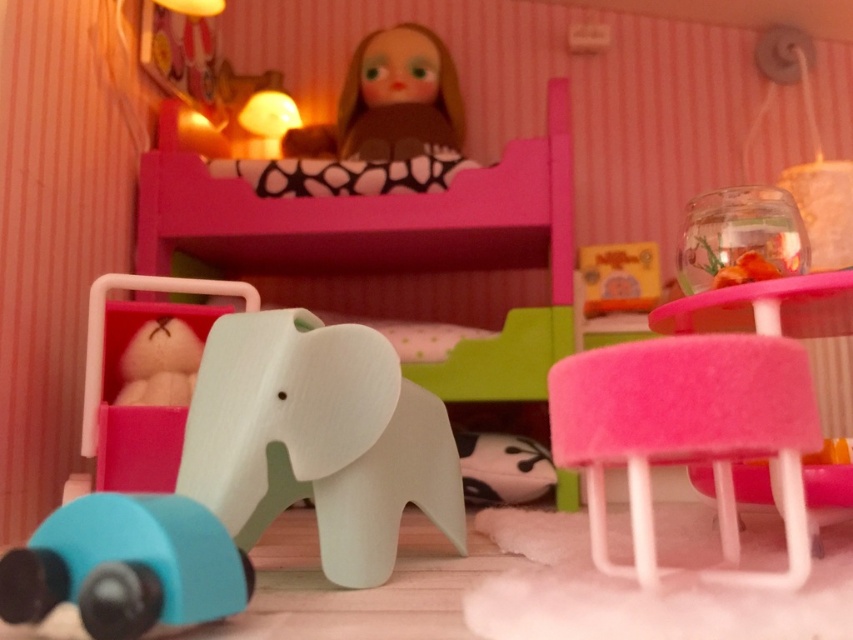
Consider the image. You are a child trying to reach the point marked at coordinates point (607,452) from your current position. If your arm can extend 28 inches, will you be able to reach it?

The distance between you and the point (607,452) is 31.68 inches, which is longer than your arm can reach. You cannot reach it.

You are a child trying to decide whether to place a new small toy on the fuzzy pink stool at lower right or the blue rubber toy car at lower left. Based on their sizes, which object can fit the new toy better?

The fuzzy pink stool at lower right is bigger than the blue rubber toy car at lower left, so the new toy would fit better on the fuzzy pink stool at lower right.

You are a child trying to reach the pink matte bunk bed at upper center from where the white matte elephant at center is standing. Do you think you can reach it without any help?

The pink matte bunk bed at upper center is much taller than the white matte elephant at center, so it might be difficult to reach without assistance.